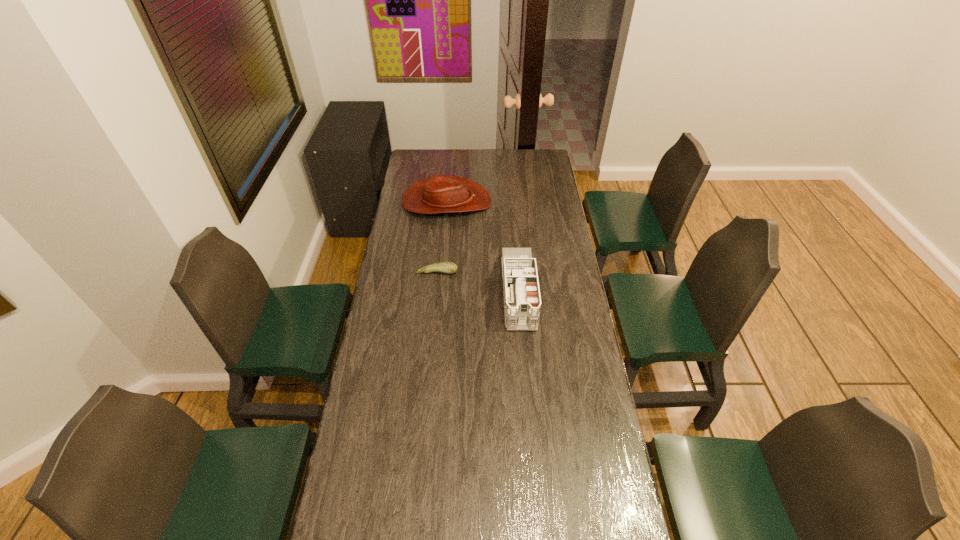
I want to click on vacant region at the right edge of the desktop, so click(536, 178).

Where is `free region at the far left corner of the desktop`? free region at the far left corner of the desktop is located at coordinates (411, 170).

Identify the location of free spot between the dollhouse and the farthest object. (483, 247).

I want to click on free space between the rightmost object and the cowboy hat, so click(483, 247).

Where is `vacant point located between the zucchini and the rightmost object`? vacant point located between the zucchini and the rightmost object is located at coordinates (478, 282).

This screenshot has width=960, height=540. I want to click on free spot between the farthest object and the dollhouse, so click(483, 247).

You are a GUI agent. You are given a task and a screenshot of the screen. Output one action in this format:
    pyautogui.click(x=<x>, y=<y>)
    Task: Click on the free space between the rightmost object and the zucchini
    This screenshot has width=960, height=540.
    Given the screenshot: What is the action you would take?
    pyautogui.click(x=478, y=282)

Find the location of a particular element. This screenshot has width=960, height=540. unoccupied position between the shortest object and the dollhouse is located at coordinates (478, 282).

Locate an element on the screen. The image size is (960, 540). free space that is in between the rightmost object and the second shortest object is located at coordinates (483, 247).

You are a GUI agent. You are given a task and a screenshot of the screen. Output one action in this format:
    pyautogui.click(x=<x>, y=<y>)
    Task: Click on the vacant space in between the zucchini and the dollhouse
    
    Given the screenshot: What is the action you would take?
    pyautogui.click(x=478, y=282)